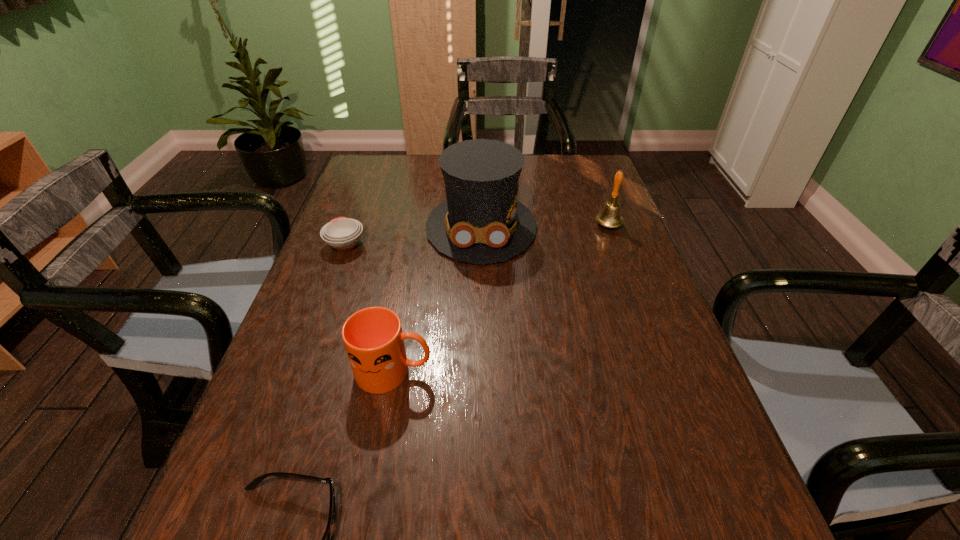
Point out which object is positioned as the third nearest to the shortest object. Please provide its 2D coordinates. Your answer should be formatted as a tuple, i.e. [(x, y)], where the tuple contains the x and y coordinates of a point satisfying the conditions above.

[(342, 233)]

You are a GUI agent. You are given a task and a screenshot of the screen. Output one action in this format:
    pyautogui.click(x=<x>, y=<y>)
    Task: Click on the blank area in the image that satisfies the following two spatial constraints: 1. on the front side of the rightmost object; 2. on the handle side of the mug
    
    Given the screenshot: What is the action you would take?
    pyautogui.click(x=662, y=372)